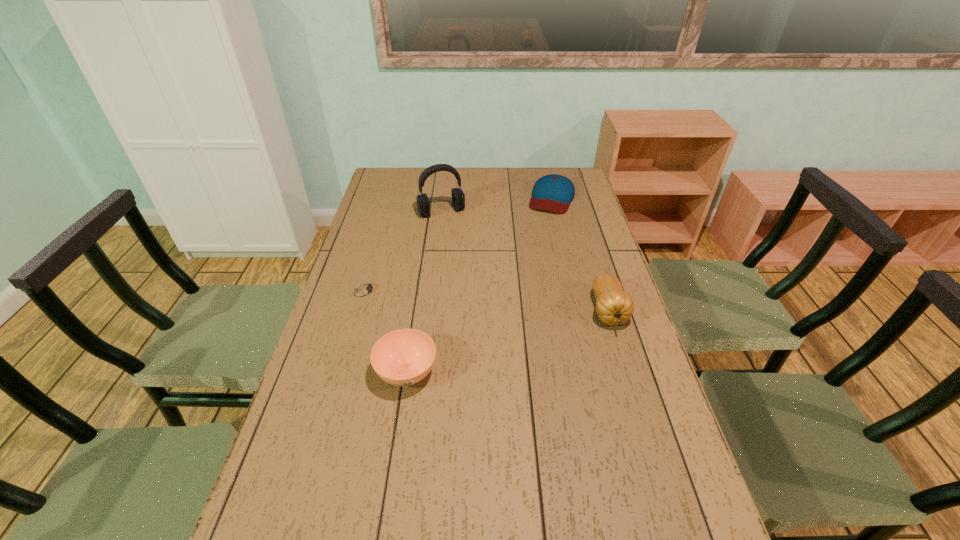
The height and width of the screenshot is (540, 960). In order to click on blank space located on the headband of the headset in this screenshot , I will do `click(477, 274)`.

This screenshot has height=540, width=960. What are the coordinates of `vacant area situated with the bill of the baseball cap facing forward` in the screenshot? It's located at (534, 249).

I want to click on vacant space located with the bill of the baseball cap facing forward, so click(528, 264).

I want to click on vacant space located 0.200m with the bill of the baseball cap facing forward, so click(x=537, y=242).

Image resolution: width=960 pixels, height=540 pixels. Identify the location of free point located on the face of the shortest object. (458, 312).

Locate an element on the screen. This screenshot has height=540, width=960. vacant space located on the face of the shortest object is located at coordinates (474, 316).

At what (x,y) coordinates should I click in order to perform the action: click on free space located on the face of the shortest object. Please return your answer as a coordinate pair (x, y). This screenshot has width=960, height=540. Looking at the image, I should click on (440, 308).

You are a GUI agent. You are given a task and a screenshot of the screen. Output one action in this format:
    pyautogui.click(x=<x>, y=<y>)
    Task: Click on the object at the far edge
    The image size is (960, 540).
    Given the screenshot: What is the action you would take?
    pyautogui.click(x=553, y=192)

At what (x,y) coordinates should I click in order to perform the action: click on object present at the left edge. Please return your answer as a coordinate pair (x, y). Looking at the image, I should click on (365, 289).

Locate an element on the screen. The height and width of the screenshot is (540, 960). gourd that is at the right edge is located at coordinates (614, 306).